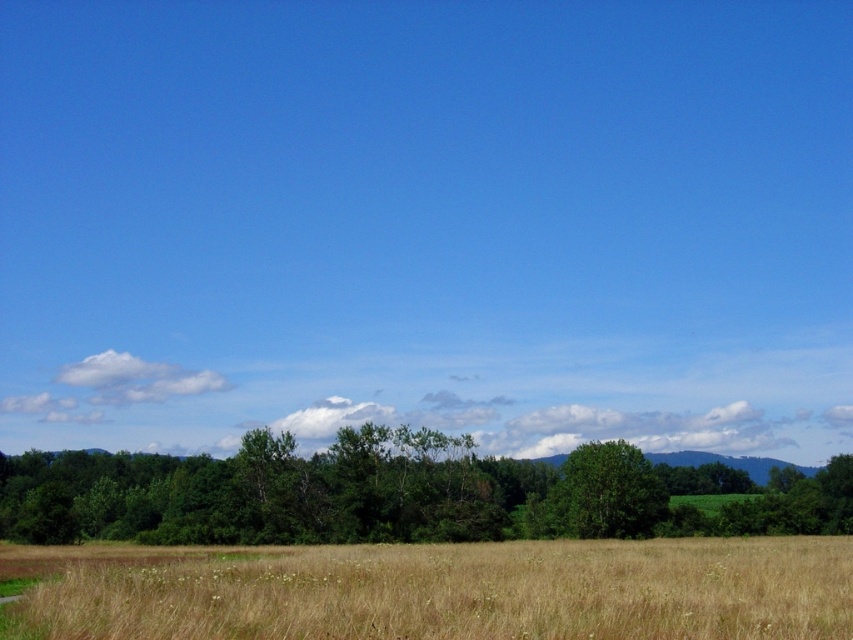
You are standing in the middle of the field of dry, golden brown grass in the foreground of this rural landscape. You spot two points in the scene labeled as point (401, 609) and point (625, 506). Which point would you reach first if you start walking straight towards them?

Point (401, 609) is closer to the viewer than point (625, 506), so you would reach point (401, 609) first.

You are standing at the edge of the brown grassy field at lower center and want to walk towards the green leafy tree at center. Which direction should you move to reach the tree?

The green leafy tree at center is located in the center of the scene, so you should move forward from the brown grassy field at lower center towards the center to reach the tree.

You are standing at the origin point in the coordinate system of the image. You want to walk to the brown grassy field at lower center. Which direction should you move in terms of x and y coordinates?

To reach the brown grassy field at lower center located at coordinates point (450, 592), you should move in the positive x and positive y direction from the origin.